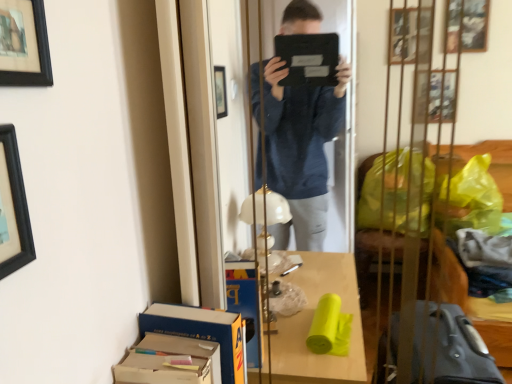
Question: Can you see cardboard box at lower left, the 1th cardboard box when ordered from back to front, touching black matte picture frame at upper left, which appears as the 1th picture frame when viewed from the top?

Choices:
 (A) no
 (B) yes

Answer: (A)

Question: Considering the relative sizes of cardboard box at lower left, the 2th cardboard box in the front-to-back sequence, and black matte picture frame at upper left, which appears as the 1th picture frame when viewed from the top, in the image provided, is cardboard box at lower left, the 2th cardboard box in the front-to-back sequence, smaller than black matte picture frame at upper left, which appears as the 1th picture frame when viewed from the top,?

Choices:
 (A) no
 (B) yes

Answer: (A)

Question: Is cardboard box at lower left, the 1th cardboard box when ordered from back to front, outside black matte picture frame at upper left, which appears as the 1th picture frame when viewed from the top?

Choices:
 (A) yes
 (B) no

Answer: (A)

Question: Considering the relative sizes of cardboard box at lower left, the 1th cardboard box when ordered from back to front, and black matte picture frame at upper left, which appears as the 1th picture frame when viewed from the top, in the image provided, is cardboard box at lower left, the 1th cardboard box when ordered from back to front, wider than black matte picture frame at upper left, which appears as the 1th picture frame when viewed from the top,?

Choices:
 (A) yes
 (B) no

Answer: (A)

Question: From the image's perspective, does cardboard box at lower left, the 1th cardboard box when ordered from back to front, appear lower than black matte picture frame at upper left, which appears as the 1th picture frame when viewed from the top?

Choices:
 (A) yes
 (B) no

Answer: (A)

Question: Would you say black matte picture frame at upper left, acting as the second picture frame starting from the top, is to the left or to the right of cardboard box at lower left, the 1th cardboard box when ordered from back to front, in the picture?

Choices:
 (A) left
 (B) right

Answer: (A)

Question: Is black matte picture frame at upper left, acting as the second picture frame starting from the top, situated inside cardboard box at lower left, the 1th cardboard box when ordered from back to front, or outside?

Choices:
 (A) inside
 (B) outside

Answer: (B)

Question: Is black matte picture frame at upper left, acting as the second picture frame starting from the top, taller or shorter than cardboard box at lower left, the 1th cardboard box when ordered from back to front?

Choices:
 (A) tall
 (B) short

Answer: (B)

Question: From the image's perspective, is black matte picture frame at upper left, acting as the second picture frame starting from the top, located above or below cardboard box at lower left, the 2th cardboard box in the front-to-back sequence?

Choices:
 (A) above
 (B) below

Answer: (A)

Question: Do you think black matte picture frame at upper left, acting as the 2th picture frame starting from the bottom, is within black matte picture frame at upper left, the first picture frame positioned from the bottom, or outside of it?

Choices:
 (A) inside
 (B) outside

Answer: (B)

Question: In the image, is black matte picture frame at upper left, which appears as the 1th picture frame when viewed from the top, positioned in front of or behind black matte picture frame at upper left, acting as the second picture frame starting from the top?

Choices:
 (A) front
 (B) behind

Answer: (A)

Question: Considering the positions of black matte picture frame at upper left, acting as the 2th picture frame starting from the bottom, and black matte picture frame at upper left, acting as the second picture frame starting from the top, in the image, is black matte picture frame at upper left, acting as the 2th picture frame starting from the bottom, taller or shorter than black matte picture frame at upper left, acting as the second picture frame starting from the top,?

Choices:
 (A) short
 (B) tall

Answer: (A)

Question: Does point (23, 71) appear closer or farther from the camera than point (3, 215)?

Choices:
 (A) closer
 (B) farther

Answer: (B)

Question: Relative to black matte picture frame at upper left, the first picture frame positioned from the bottom, is cardboard box at lower left, which ranks as the first cardboard box in front-to-back order, in front or behind?

Choices:
 (A) behind
 (B) front

Answer: (A)

Question: Is point (181, 347) closer or farther from the camera than point (15, 144)?

Choices:
 (A) closer
 (B) farther

Answer: (B)